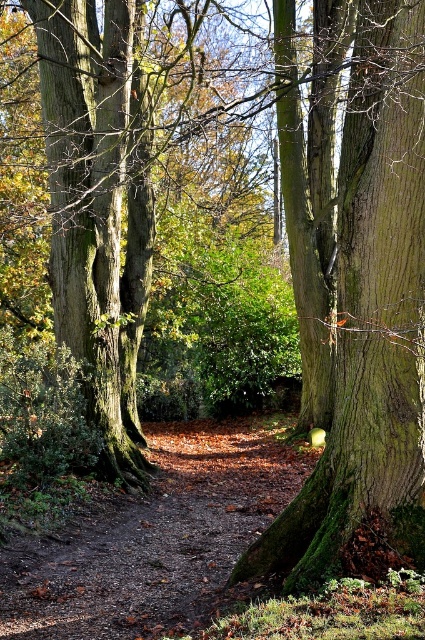
Does point (376, 404) lie in front of point (85, 390)?

That is True.

Which is behind, point (309, 532) or point (98, 193)?

The point (98, 193) is behind.

Is point (376, 436) positioned before point (105, 228)?

Yes, it is in front of point (105, 228).

Image resolution: width=425 pixels, height=640 pixels. Find the location of `green mossy tree trunk at right`. green mossy tree trunk at right is located at coordinates (368, 308).